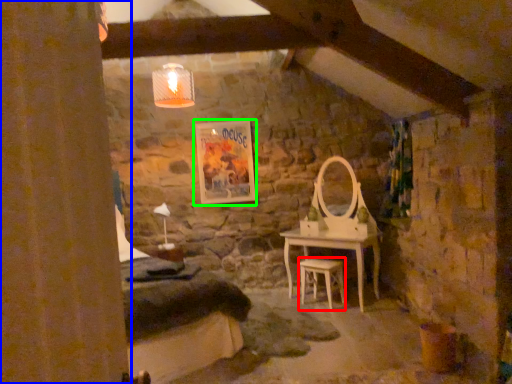
Question: Which object is positioned farthest from stool (highlighted by a red box)? Select from curtain (highlighted by a blue box) and picture frame (highlighted by a green box).

Choices:
 (A) curtain
 (B) picture frame

Answer: (A)